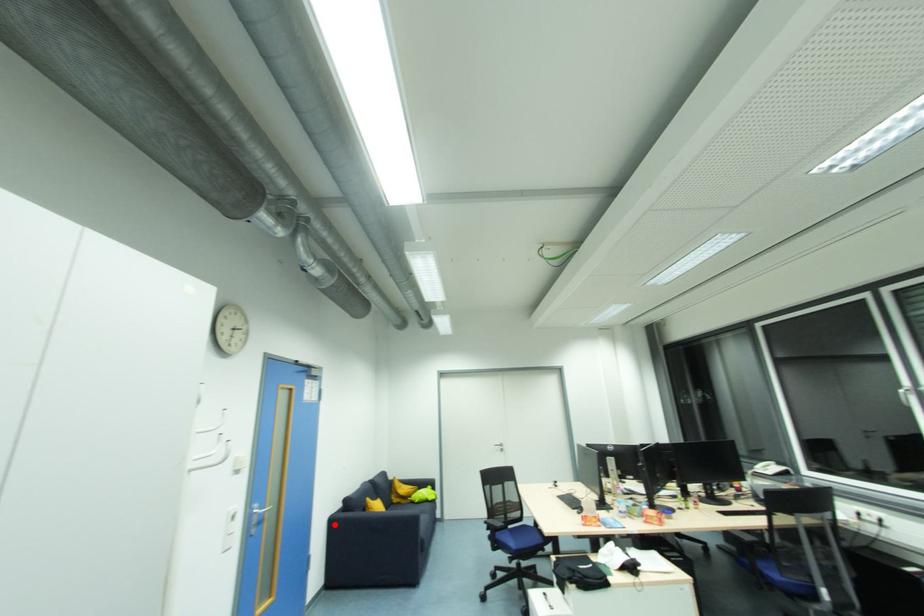
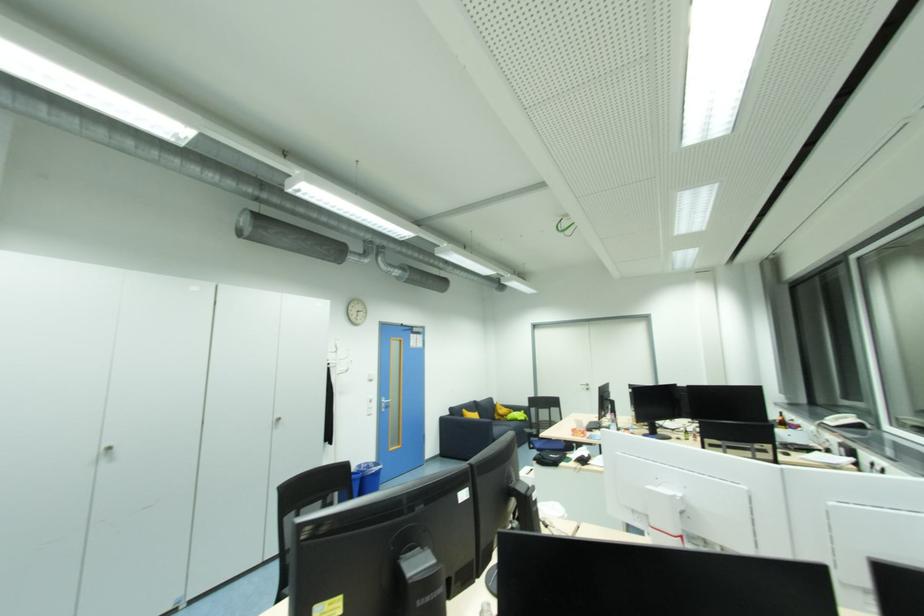
Find the pixel in the second image that matches the highlighted location in the first image.

(445, 421)